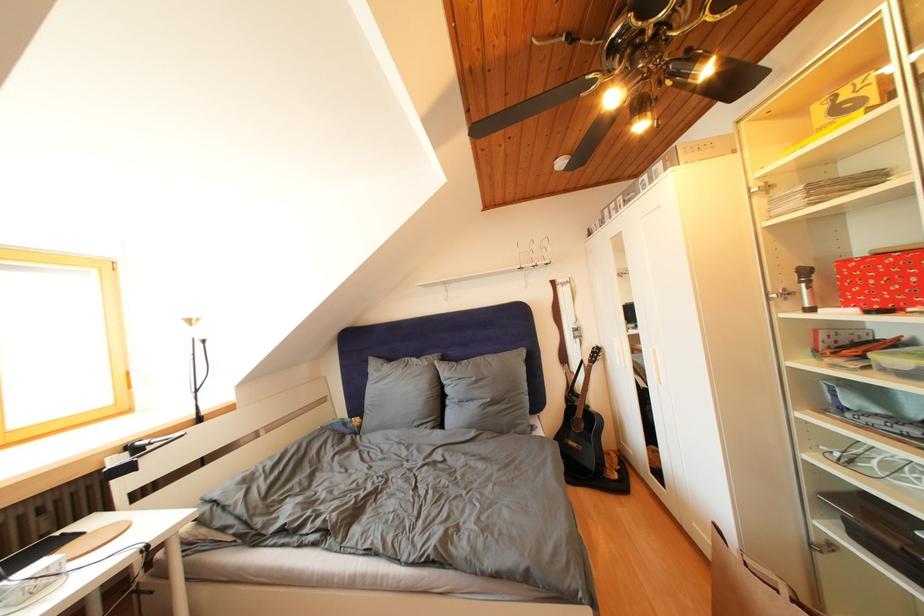
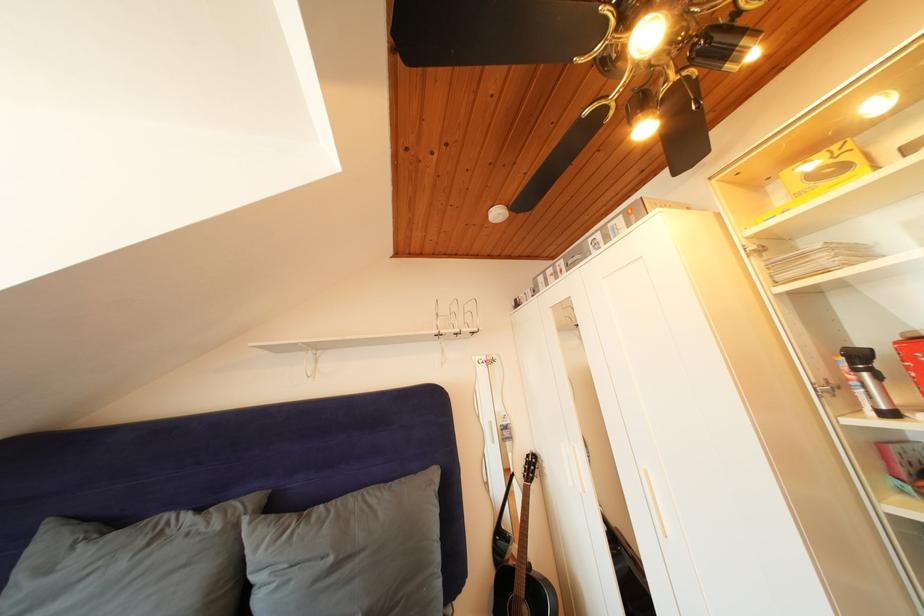
The images are taken continuously from a first-person perspective. In which direction is your viewpoint rotating?

The camera's rotation is toward right-up.